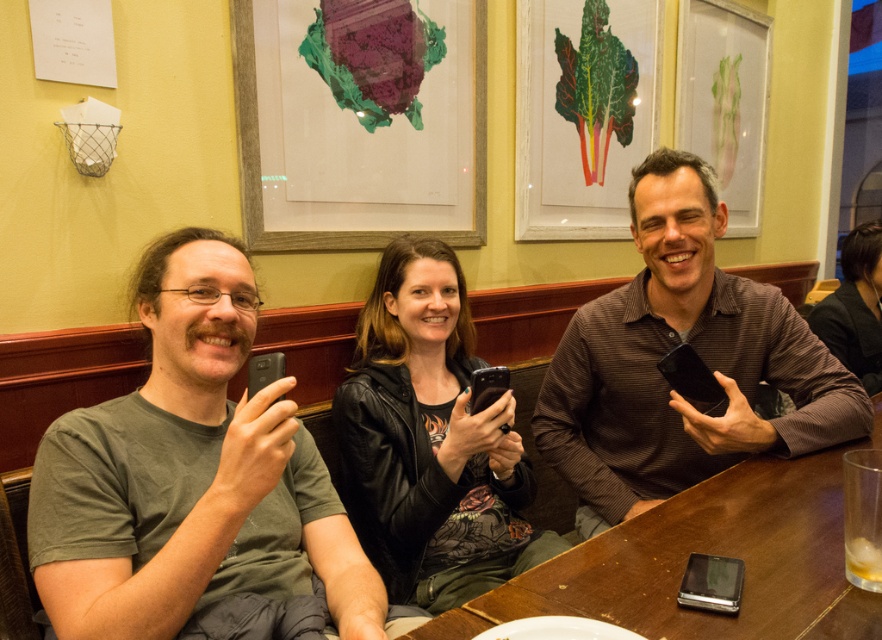
You are a photographer trying to capture a group photo of the black leather jacket at center and the brown wooden table at center. Which object should you focus on first if you want to ensure both are in focus, considering their heights?

The black leather jacket at center is taller than the brown wooden table at center. To ensure both are in focus, you should focus on the black leather jacket at center first as it is taller and likely further away from the camera.

Looking at this image, you are a photographer trying to capture a group photo of the green matte shirt at left and the black leather jacket at upper right. The camera you are using has a maximum focus range of 2 meters. Will you be able to focus on both subjects simultaneously?

The distance between the green matte shirt at left and the black leather jacket at upper right is 2.14 meters. Since the camera can only focus up to 2 meters, it won

You are a photographer trying to capture a candid shot of the green matte shirt at left without being noticed. The camera you are using has a minimum focusing distance of 30 inches. Can you take the photo from your current position?

The green matte shirt at left and camera are 31.04 inches apart from each other, so yes, you can take the photo because the distance is within the camera minimum focusing distance of 30 inches.